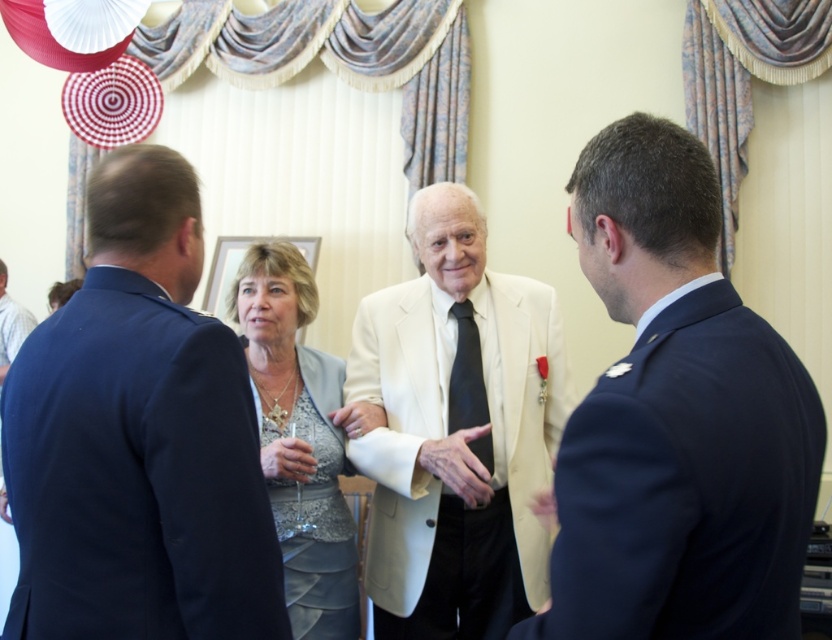
Between point (595, 204) and point (278, 536), which one is positioned behind?

Positioned behind is point (278, 536).

The image size is (832, 640). In order to click on matte blue suit at right in this screenshot , I will do `click(676, 419)`.

Who is shorter, gray satin dress at center or black silk tie at center?

black silk tie at center

Between gray satin dress at center and black silk tie at center, which one appears on the right side from the viewer's perspective?

From the viewer's perspective, black silk tie at center appears more on the right side.

Does point (330, 564) come closer to viewer compared to point (461, 417)?

Yes.

The image size is (832, 640). Identify the location of gray satin dress at center. (300, 436).

Between matte blue suit at right and blue fabric suit at center, which one has more height?

blue fabric suit at center is taller.

Between matte blue suit at right and blue fabric suit at center, which one is positioned higher?

Positioned higher is matte blue suit at right.

Between point (608, 157) and point (102, 220), which one is positioned behind?

The point (102, 220) is behind.

Where is `matte blue suit at right`? Image resolution: width=832 pixels, height=640 pixels. matte blue suit at right is located at coordinates (676, 419).